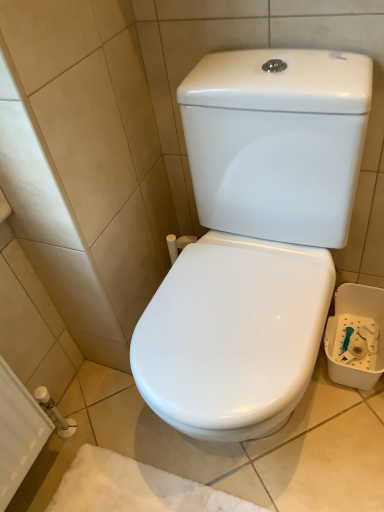
Find the location of a particular element. The width and height of the screenshot is (384, 512). white glossy toilet at center is located at coordinates (255, 238).

Describe the element at coordinates (255, 238) in the screenshot. I see `white glossy toilet at center` at that location.

What are the coordinates of `white glossy toilet at center` in the screenshot? It's located at (255, 238).